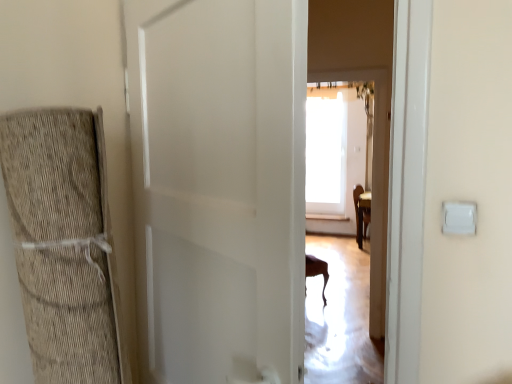
Question: Does white matte door at center lie in front of white plastic light switch at right?

Choices:
 (A) yes
 (B) no

Answer: (A)

Question: Considering the relative sizes of white matte door at center and white plastic light switch at right in the image provided, is white matte door at center smaller than white plastic light switch at right?

Choices:
 (A) yes
 (B) no

Answer: (B)

Question: Is white plastic light switch at right at the back of white matte door at center?

Choices:
 (A) yes
 (B) no

Answer: (B)

Question: Considering the relative positions of white matte door at center and white plastic light switch at right in the image provided, is white matte door at center to the left of white plastic light switch at right from the viewer's perspective?

Choices:
 (A) no
 (B) yes

Answer: (B)

Question: Is white plastic light switch at right completely or partially inside white matte door at center?

Choices:
 (A) yes
 (B) no

Answer: (B)

Question: Considering the relative sizes of white matte door at center and white plastic light switch at right in the image provided, is white matte door at center taller than white plastic light switch at right?

Choices:
 (A) yes
 (B) no

Answer: (A)

Question: From a real-world perspective, is white plastic light switch at right beneath white matte door at center?

Choices:
 (A) no
 (B) yes

Answer: (A)

Question: Can you see white plastic light switch at right touching white matte door at center?

Choices:
 (A) yes
 (B) no

Answer: (B)

Question: Is white plastic light switch at right not inside white matte door at center?

Choices:
 (A) yes
 (B) no

Answer: (A)

Question: Can you confirm if white plastic light switch at right is positioned to the left of white matte door at center?

Choices:
 (A) yes
 (B) no

Answer: (B)

Question: Is white plastic light switch at right smaller than white matte door at center?

Choices:
 (A) no
 (B) yes

Answer: (B)

Question: Does white plastic light switch at right turn towards white matte door at center?

Choices:
 (A) no
 (B) yes

Answer: (A)

Question: Is white matte door at center to the left or to the right of white plastic light switch at right in the image?

Choices:
 (A) right
 (B) left

Answer: (B)